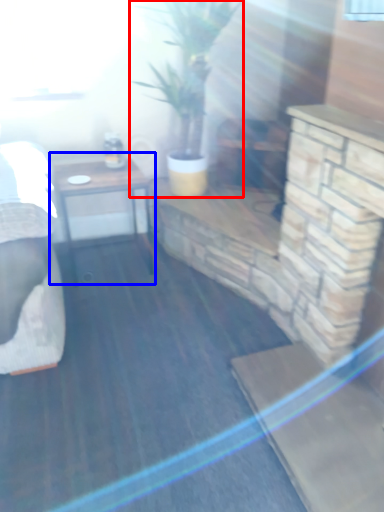
Question: Which object appears farthest to the camera in this image, houseplant (highlighted by a red box) or table (highlighted by a blue box)?

Choices:
 (A) houseplant
 (B) table

Answer: (B)